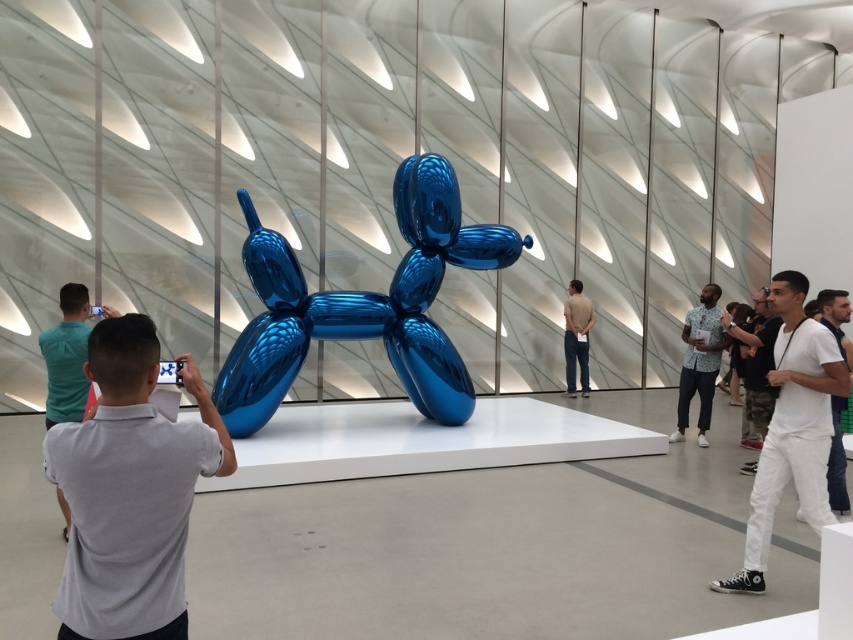
Is shiny blue balloon dog at center shorter than floral shirt at right?

In fact, shiny blue balloon dog at center may be taller than floral shirt at right.

Between point (450, 404) and point (695, 346), which one is positioned behind?

The point (695, 346) is behind.

The width and height of the screenshot is (853, 640). Identify the location of shiny blue balloon dog at center. (363, 305).

Who is taller, gray shirt at center or shiny blue balloon dog at center?

shiny blue balloon dog at center is taller.

The height and width of the screenshot is (640, 853). Find the location of `gray shirt at center`. gray shirt at center is located at coordinates (131, 490).

At what (x,y) coordinates should I click in order to perform the action: click on gray shirt at center. Please return your answer as a coordinate pair (x, y). Image resolution: width=853 pixels, height=640 pixels. Looking at the image, I should click on (131, 490).

In order to click on gray shirt at center in this screenshot , I will do `click(131, 490)`.

Does point (801, 381) come farther from viewer compared to point (843, 320)?

No, it is not.

Between point (749, 502) and point (840, 460), which one is positioned behind?

The point (840, 460) is behind.

The image size is (853, 640). I want to click on white cotton pants at right, so click(x=792, y=428).